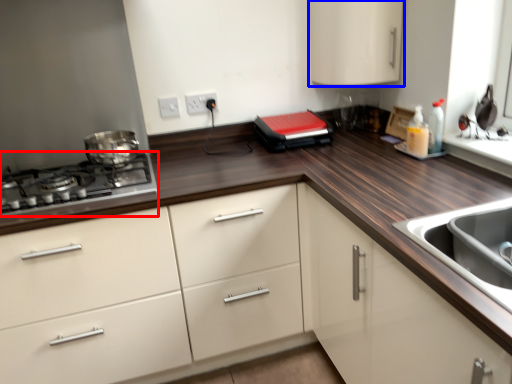
Question: Which object is further to the camera taking this photo, gas stove (highlighted by a red box) or cabinetry (highlighted by a blue box)?

Choices:
 (A) gas stove
 (B) cabinetry

Answer: (B)